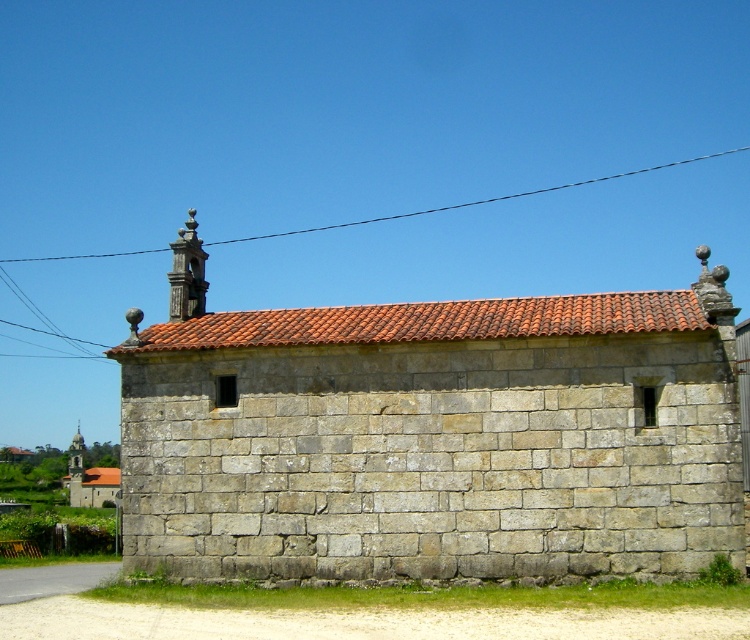
You are an electrician assessing the space between the black wire at upper center and the stone church at left. Can you fit a new electrical cable that is 1.2 meters wide between them?

The black wire at upper center is wider than the stone church at left, but the description does not specify the distance between them. Therefore, it is unclear if the 1.2 meter wide cable can fit between them.

You are standing in front of a gray stone chapel at center and a black wire at upper center. Which object is positioned to the left?

The black wire at upper center is positioned to the left of the gray stone chapel at center.

You are standing in a field and see the gray stone chapel at center and the stone church at left. Which one is positioned more to the east?

The gray stone chapel at center is positioned to the right of the stone church at left, so the gray stone chapel at center is more to the east since it is on the right side from the observer.